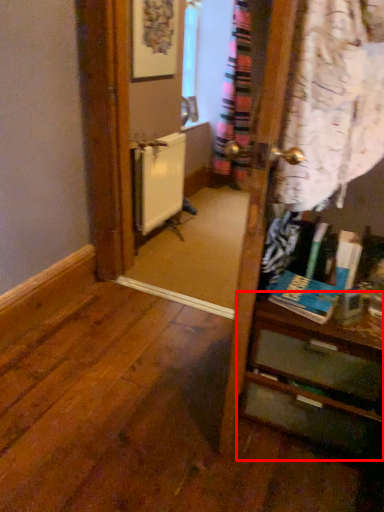
Question: From the image's perspective, what is the correct spatial relationship of vanity (annotated by the red box) in relation to radiator?

Choices:
 (A) above
 (B) below

Answer: (B)